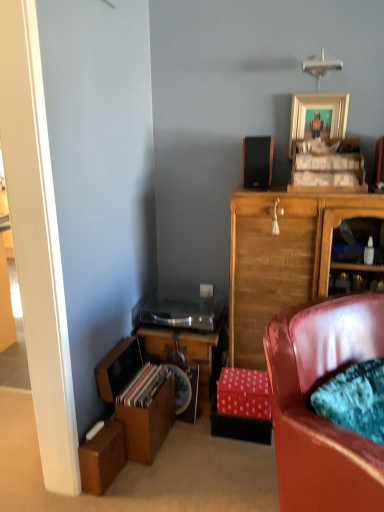
Question: From their relative heights in the image, would you say gold metallic picture frame at upper center is taller or shorter than velvet teal cushion at lower right?

Choices:
 (A) short
 (B) tall

Answer: (A)

Question: In terms of size, does gold metallic picture frame at upper center appear bigger or smaller than velvet teal cushion at lower right?

Choices:
 (A) big
 (B) small

Answer: (B)

Question: Considering the real-world distances, which object is farthest from the brown cardboard box at lower left, which is the first cardboard box from bottom to top?

Choices:
 (A) pink polka dot cardboard box at lower center, the 1th cardboard box in the top-to-bottom sequence
 (B) black matte speaker at upper center
 (C) gold metallic picture frame at upper center
 (D) wooden cabinet at upper right
 (E) velvet teal cushion at lower right

Answer: (C)

Question: Considering the real-world distances, which object is farthest from the brown cardboard box at lower left, placed as the 1th cardboard box when sorted from front to back?

Choices:
 (A) gold metallic picture frame at upper center
 (B) pink polka dot cardboard box at lower center, which is the second cardboard box in bottom-to-top order
 (C) wooden cabinet at upper right
 (D) black matte speaker at upper center
 (E) velvet teal cushion at lower right

Answer: (A)